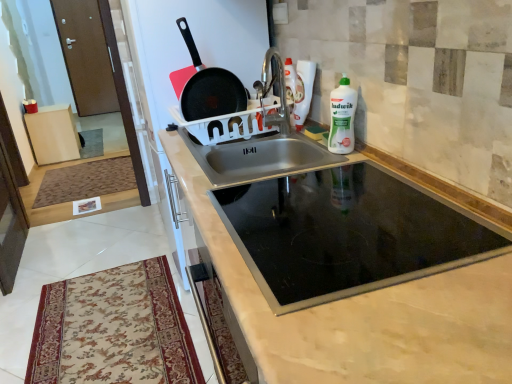
Measure the distance between point (161, 298) and camera.

The distance of point (161, 298) from camera is 7.16 feet.

What do you see at coordinates (209, 87) in the screenshot?
I see `black matte frying pan at upper center` at bounding box center [209, 87].

What is the approximate height of brown wooden door at upper left?

1.79 meters.

The width and height of the screenshot is (512, 384). What do you see at coordinates (362, 314) in the screenshot?
I see `black glass cooktop at center` at bounding box center [362, 314].

What is the approximate height of black glass cooktop at center?

It is 73.28 centimeters.

This screenshot has height=384, width=512. I want to click on white plastic bottle at upper right, so click(303, 91).

What is the approximate width of brown textured mat at lower left, which is the second mat in bottom-to-top order?

It is 3.44 feet.

Identify the location of beige floral rug at lower left, acting as the first mat starting from the front. (113, 329).

Consider the image. Who is bigger, brown wooden door at upper left or brown textured mat at lower left, which is the first mat from back to front?

With larger size is brown wooden door at upper left.

Which is more to the right, brown wooden door at upper left or brown textured mat at lower left, the 1th mat from the left?

brown textured mat at lower left, the 1th mat from the left.

Choose the correct answer: Is brown wooden door at upper left inside brown textured mat at lower left, marked as the first mat in a top-to-bottom arrangement, or outside it?

brown wooden door at upper left exists outside the volume of brown textured mat at lower left, marked as the first mat in a top-to-bottom arrangement.

Between brown wooden door at upper left and brown textured mat at lower left, marked as the first mat in a top-to-bottom arrangement, which one has more height?

brown wooden door at upper left.

Is black glass cooktop at center shorter than white plastic bottle at upper right?

In fact, black glass cooktop at center may be taller than white plastic bottle at upper right.

Can you confirm if black glass cooktop at center is wider than white plastic bottle at upper right?

Indeed, black glass cooktop at center has a greater width compared to white plastic bottle at upper right.

Is white plastic bottle at upper right wider or thinner than black matte frying pan at upper center?

Clearly, white plastic bottle at upper right has less width compared to black matte frying pan at upper center.

Considering the relative positions of white plastic bottle at upper right and black matte frying pan at upper center in the image provided, is white plastic bottle at upper right to the right of black matte frying pan at upper center from the viewer's perspective?

Correct, you'll find white plastic bottle at upper right to the right of black matte frying pan at upper center.

Based on the photo, considering the relative sizes of white plastic bottle at upper right and black matte frying pan at upper center in the image provided, is white plastic bottle at upper right taller than black matte frying pan at upper center?

No.

Is brown wooden door at upper left inside beige floral rug at lower left, placed as the first mat when sorted from bottom to top?

That's incorrect, brown wooden door at upper left is not inside beige floral rug at lower left, placed as the first mat when sorted from bottom to top.

Is beige floral rug at lower left, which is counted as the second mat, starting from the top, not near brown wooden door at upper left?

Yes, beige floral rug at lower left, which is counted as the second mat, starting from the top, and brown wooden door at upper left are quite far apart.

Can you confirm if beige floral rug at lower left, which is counted as the second mat, starting from the top, is positioned to the left of brown wooden door at upper left?

No.

Which object is further away from the camera, beige floral rug at lower left, arranged as the 2th mat when viewed from the back, or brown wooden door at upper left?

brown wooden door at upper left.

Can you confirm if black glass cooktop at center is wider than brown textured mat at lower left, which is the first mat from back to front?

Incorrect, the width of black glass cooktop at center does not surpass that of brown textured mat at lower left, which is the first mat from back to front.

Does black glass cooktop at center have a smaller size compared to brown textured mat at lower left, the 1th mat from the left?

No.

Does black glass cooktop at center touch brown textured mat at lower left, which is the first mat from back to front?

No.

Is brown textured mat at lower left, marked as the second mat in a right-to-left arrangement, to the right of white plastic bottle at upper right from the viewer's perspective?

Incorrect, brown textured mat at lower left, marked as the second mat in a right-to-left arrangement, is not on the right side of white plastic bottle at upper right.

Can you confirm if brown textured mat at lower left, marked as the first mat in a top-to-bottom arrangement, is thinner than white plastic bottle at upper right?

Incorrect, the width of brown textured mat at lower left, marked as the first mat in a top-to-bottom arrangement, is not less than that of white plastic bottle at upper right.

Is brown textured mat at lower left, marked as the second mat in a right-to-left arrangement, further to camera compared to white plastic bottle at upper right?

Yes.

Is brown textured mat at lower left, marked as the first mat in a top-to-bottom arrangement, taller or shorter than white plastic bottle at upper right?

Clearly, brown textured mat at lower left, marked as the first mat in a top-to-bottom arrangement, is shorter compared to white plastic bottle at upper right.

Which object is wider, white plastic bottle at upper right or white plastic bottle at upper right?

With larger width is white plastic bottle at upper right.

Which point is more distant from viewer, (302, 121) or (356, 93)?

Positioned behind is point (302, 121).

Is white plastic bottle at upper right situated inside white plastic bottle at upper right or outside?

The correct answer is: outside.

This screenshot has height=384, width=512. Find the location of `glass door above the brown textured mat at lower left, marked as the second mat in a right-to-left arrangement (from a real-world perspective)`. glass door above the brown textured mat at lower left, marked as the second mat in a right-to-left arrangement (from a real-world perspective) is located at coordinates (86, 56).

Identify the location of cabinetry in front of the white plastic bottle at upper right. This screenshot has height=384, width=512. (362, 314).

From the image, which object appears to be nearer to white plastic bottle at upper right, brown textured mat at lower left, the 1th mat from the left, or beige floral rug at lower left, arranged as the 2th mat when viewed from the back?

Based on the image, beige floral rug at lower left, arranged as the 2th mat when viewed from the back, appears to be nearer to white plastic bottle at upper right.

From the image, which object appears to be farther from brown textured mat at lower left, which is the first mat from back to front, black matte frying pan at upper center or beige floral rug at lower left, acting as the first mat starting from the front?

black matte frying pan at upper center.

Estimate the real-world distances between objects in this image. Which object is closer to brown textured mat at lower left, marked as the first mat in a top-to-bottom arrangement, white plastic bottle at upper right or brown wooden door at upper left?

The object closer to brown textured mat at lower left, marked as the first mat in a top-to-bottom arrangement, is brown wooden door at upper left.

When comparing their distances from beige floral rug at lower left, arranged as the 2th mat when viewed from the back, does black glass cooktop at center or brown textured mat at lower left, the 1th mat from the left, seem closer?

The object closer to beige floral rug at lower left, arranged as the 2th mat when viewed from the back, is black glass cooktop at center.

Which object lies further to the anchor point beige floral rug at lower left, arranged as the 2th mat when viewed from the back, black matte frying pan at upper center or brown wooden door at upper left?

brown wooden door at upper left is further to beige floral rug at lower left, arranged as the 2th mat when viewed from the back.

Based on their spatial positions, is beige floral rug at lower left, acting as the first mat starting from the front, or brown wooden door at upper left closer to white plastic bottle at upper right?

beige floral rug at lower left, acting as the first mat starting from the front, is closer to white plastic bottle at upper right.

From the image, which object appears to be nearer to white plastic bottle at upper right, white plastic bottle at upper right or black matte frying pan at upper center?

Based on the image, white plastic bottle at upper right appears to be nearer to white plastic bottle at upper right.

Based on their spatial positions, is brown wooden door at upper left or brown textured mat at lower left, the 1th mat from the left, closer to black matte frying pan at upper center?

brown textured mat at lower left, the 1th mat from the left, lies closer to black matte frying pan at upper center than the other object.

This screenshot has width=512, height=384. I want to click on cleaning product located between beige floral rug at lower left, placed as the first mat when sorted from bottom to top, and brown wooden door at upper left in the depth direction, so click(x=303, y=91).

Locate an element on the screen. The height and width of the screenshot is (384, 512). cabinetry that lies between white plastic bottle at upper right and beige floral rug at lower left, the 2th mat positioned from the left, from top to bottom is located at coordinates (362, 314).

What are the coordinates of `bottle between black matte frying pan at upper center and black glass cooktop at center vertically` in the screenshot? It's located at (342, 117).

In order to click on frying pan between black glass cooktop at center and brown wooden door at upper left along the z-axis in this screenshot , I will do `click(209, 87)`.